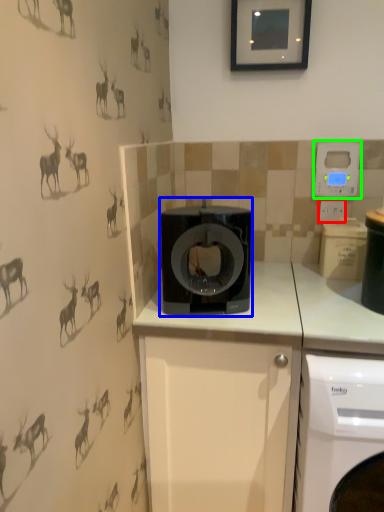
Question: Which is farther away from electric outlet (highlighted by a red box)? home appliance (highlighted by a blue box) or thermostat (highlighted by a green box)?

Choices:
 (A) home appliance
 (B) thermostat

Answer: (A)